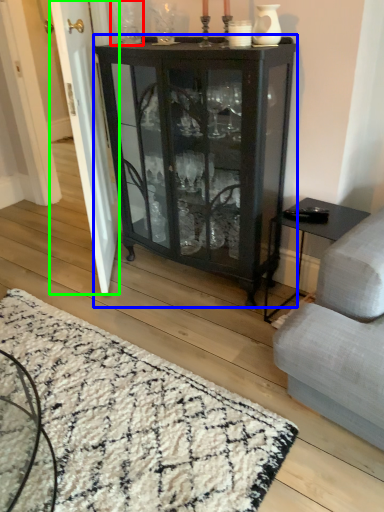
Question: Which object is the farthest from glass vase (highlighted by a red box)? Choose among these: cupboard (highlighted by a blue box) or screen door (highlighted by a green box).

Choices:
 (A) cupboard
 (B) screen door

Answer: (A)